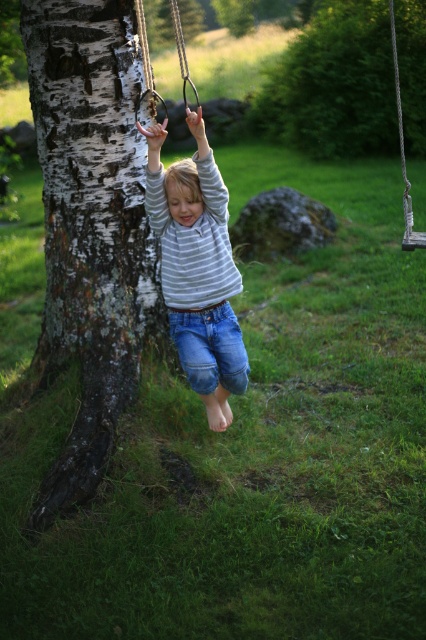
Question: Based on their relative distances, which object is farther from the striped cotton shirt at center?

Choices:
 (A) green leafy tree at upper center
 (B) white bark tree trunk at left

Answer: (A)

Question: Can you confirm if white bark tree trunk at left is thinner than rope swing at center?

Choices:
 (A) yes
 (B) no

Answer: (B)

Question: Based on their relative distances, which object is nearer to the rope swing at center?

Choices:
 (A) green leafy tree at upper center
 (B) striped cotton shirt at center

Answer: (B)

Question: Which of the following is the farthest from the observer?

Choices:
 (A) (66, 120)
 (B) (176, 29)
 (C) (224, 396)
 (D) (359, 152)

Answer: (D)

Question: Does green leafy tree at upper center have a lesser width compared to striped cotton shirt at center?

Choices:
 (A) yes
 (B) no

Answer: (B)

Question: Is green leafy tree at upper center thinner than striped cotton shirt at center?

Choices:
 (A) yes
 (B) no

Answer: (B)